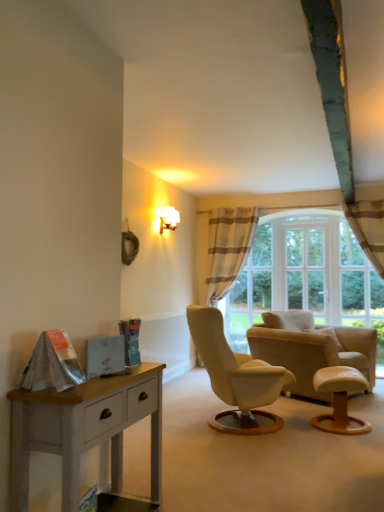
This screenshot has height=512, width=384. Describe the element at coordinates (311, 349) in the screenshot. I see `beige leather chair at center` at that location.

The width and height of the screenshot is (384, 512). I want to click on white ribbed radiator at center, so click(166, 342).

What is the approximate height of striped fabric curtain at center?

striped fabric curtain at center is 7.35 feet in height.

Where is `light brown wooden stool at lower right`? The image size is (384, 512). light brown wooden stool at lower right is located at coordinates (340, 399).

Based on the photo, measure the distance between point (306, 262) and camera.

They are 6.14 meters apart.

Identify the location of white glossy wall sconce at upper right. (169, 219).

Where is `curtain lying behind the beige leather chair at center`? This screenshot has width=384, height=512. curtain lying behind the beige leather chair at center is located at coordinates (228, 247).

Considering the sizes of objects beige leather chair at center and striped fabric curtain at center in the image provided, who is shorter, beige leather chair at center or striped fabric curtain at center?

Standing shorter between the two is beige leather chair at center.

Is beige leather chair at center oriented away from striped fabric curtain at center?

Yes, beige leather chair at center is facing away from striped fabric curtain at center.

Does point (371, 379) appear closer or farther from the camera than point (214, 218)?

Point (371, 379) appears to be closer to the viewer than point (214, 218).

Considering the relative positions of white painted wood nightstand at lower left and white ribbed radiator at center in the image provided, is white painted wood nightstand at lower left to the right of white ribbed radiator at center from the viewer's perspective?

No, white painted wood nightstand at lower left is not to the right of white ribbed radiator at center.

How far apart are white painted wood nightstand at lower left and white ribbed radiator at center?

white painted wood nightstand at lower left and white ribbed radiator at center are 7.43 feet apart.

From a real-world perspective, relative to white ribbed radiator at center, is white painted wood nightstand at lower left vertically above or below?

From a real-world perspective, white painted wood nightstand at lower left is physically below white ribbed radiator at center.

From the image's perspective, between white painted wood nightstand at lower left and white ribbed radiator at center, who is located below?

From the image's view, white ribbed radiator at center is below.

Consider the image. Which object is thinner, white ribbed radiator at center or striped fabric curtain at center?

white ribbed radiator at center is thinner.

Is white ribbed radiator at center not close to striped fabric curtain at center?

That's right, there is a large distance between white ribbed radiator at center and striped fabric curtain at center.

Which object is further away from the camera taking this photo, white glossy wall sconce at upper right or white painted wood nightstand at lower left?

white glossy wall sconce at upper right is further away from the camera.

From the image's perspective, is white glossy wall sconce at upper right below white painted wood nightstand at lower left?

No, from the image's perspective, white glossy wall sconce at upper right is not below white painted wood nightstand at lower left.

From a real-world perspective, which is physically below, white glossy wall sconce at upper right or white painted wood nightstand at lower left?

white painted wood nightstand at lower left.

Is white glossy wall sconce at upper right in front of beige leather chair at center?

No, white glossy wall sconce at upper right is further to the viewer.

Between white glossy wall sconce at upper right and beige leather chair at center, which one has smaller size?

With smaller size is white glossy wall sconce at upper right.

Which is behind, point (177, 217) or point (309, 337)?

The point (177, 217) is behind.

From the image's perspective, is white painted wood nightstand at lower left located above or below white glossy wall sconce at upper right?

Based on their image positions, white painted wood nightstand at lower left is located beneath white glossy wall sconce at upper right.

Can white glossy wall sconce at upper right be found inside white painted wood nightstand at lower left?

No, white glossy wall sconce at upper right is not surrounded by white painted wood nightstand at lower left.

From the picture: Is white glossy wall sconce at upper right at the back of white painted wood nightstand at lower left?

white painted wood nightstand at lower left does not have its back to white glossy wall sconce at upper right.

Is beige leather chair at center further to camera compared to white painted wood nightstand at lower left?

Yes, it is behind white painted wood nightstand at lower left.

Considering the points (312, 343) and (89, 399), which point is in front, point (312, 343) or point (89, 399)?

Point (89, 399)

From the image's perspective, is beige leather chair at center located above white painted wood nightstand at lower left?

No, from the image's perspective, beige leather chair at center is not on top of white painted wood nightstand at lower left.

Considering the positions of objects beige leather chair at center and white painted wood nightstand at lower left in the image provided, who is more to the right, beige leather chair at center or white painted wood nightstand at lower left?

From the viewer's perspective, beige leather chair at center appears more on the right side.

Find the location of `curtain behind the beige leather chair at center`. curtain behind the beige leather chair at center is located at coordinates (228, 247).

You are a GUI agent. You are given a task and a screenshot of the screen. Output one action in this format:
    pyautogui.click(x=<x>, y=<y>)
    Task: Click on the nightstand below the white ribbed radiator at center (from a real-world perspective)
    This screenshot has height=512, width=384.
    Given the screenshot: What is the action you would take?
    pyautogui.click(x=84, y=429)

When comparing their distances from white glossy wall sconce at upper right, does white ribbed radiator at center or striped fabric curtain at center seem further?

The object further to white glossy wall sconce at upper right is white ribbed radiator at center.

Considering their positions, is white ribbed radiator at center positioned further to white painted wood nightstand at lower left than light brown wooden stool at lower right?

Among the two, white ribbed radiator at center is located further to white painted wood nightstand at lower left.

When comparing their distances from white painted wood nightstand at lower left, does white ribbed radiator at center or beige leather chair at center seem further?

beige leather chair at center is positioned further to the anchor white painted wood nightstand at lower left.

Estimate the real-world distances between objects in this image. Which object is closer to light brown wooden stool at lower right, white ribbed radiator at center or striped fabric curtain at center?

white ribbed radiator at center is positioned closer to the anchor light brown wooden stool at lower right.

When comparing their distances from white ribbed radiator at center, does light brown wooden stool at lower right or beige leather chair at center seem further?

Based on the image, light brown wooden stool at lower right appears to be further to white ribbed radiator at center.

From the picture: When comparing their distances from white painted wood nightstand at lower left, does beige leather chair at center or white glass window at center seem further?

Based on the image, white glass window at center appears to be further to white painted wood nightstand at lower left.

Which object lies further to the anchor point white painted wood nightstand at lower left, beige leather chair at center or white glossy wall sconce at upper right?

The object further to white painted wood nightstand at lower left is white glossy wall sconce at upper right.

Considering their positions, is white painted wood nightstand at lower left positioned closer to white glossy wall sconce at upper right than beige leather chair at center?

Among the two, beige leather chair at center is located nearer to white glossy wall sconce at upper right.

The height and width of the screenshot is (512, 384). I want to click on radiator located between white painted wood nightstand at lower left and striped fabric curtain at center in the depth direction, so click(x=166, y=342).

Where is `curtain located between white ribbed radiator at center and white glass window at center in the left-right direction`? This screenshot has width=384, height=512. curtain located between white ribbed radiator at center and white glass window at center in the left-right direction is located at coordinates (228, 247).

In order to click on radiator located between beige leather chair at center and striped fabric curtain at center in the depth direction in this screenshot , I will do `click(166, 342)`.

At what (x,y) coordinates should I click in order to perform the action: click on curtain located between beige leather chair at center and white glass window at center in the depth direction. Please return your answer as a coordinate pair (x, y). The height and width of the screenshot is (512, 384). Looking at the image, I should click on (228, 247).